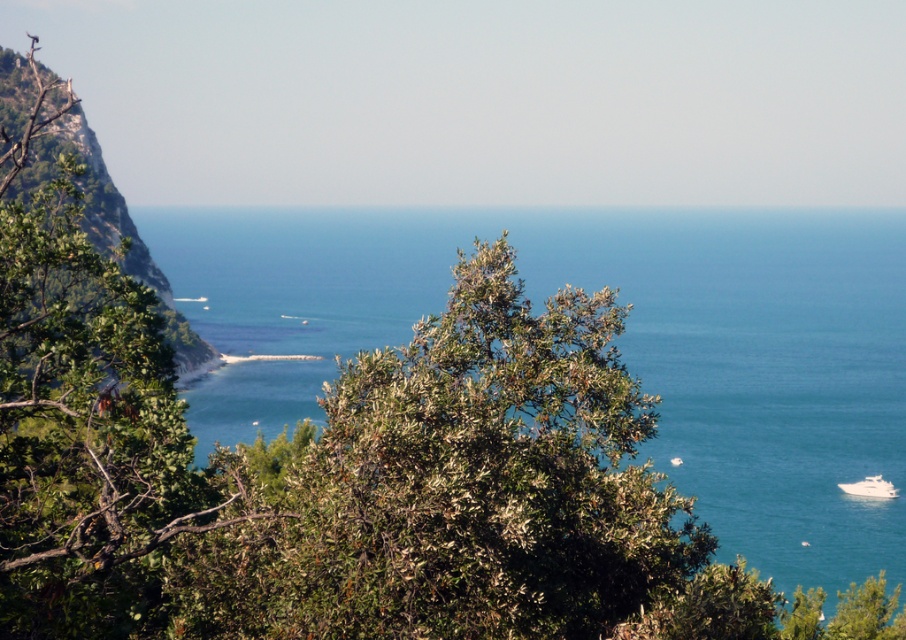
The height and width of the screenshot is (640, 906). Describe the element at coordinates (631, 340) in the screenshot. I see `blue water at center` at that location.

Between point (420, 241) and point (136, 252), which one is positioned in front?

Positioned in front is point (136, 252).

Where is `blue water at center`? Image resolution: width=906 pixels, height=640 pixels. blue water at center is located at coordinates (631, 340).